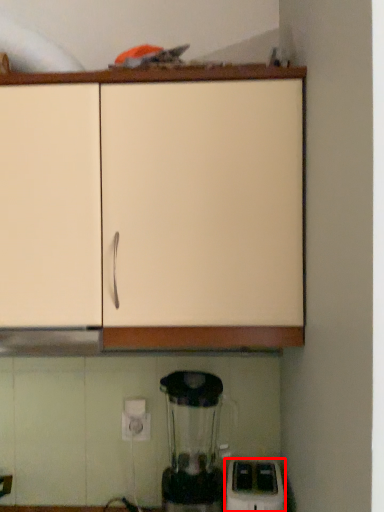
Question: Where is home appliance (annotated by the red box) located in relation to cabinetry in the image?

Choices:
 (A) left
 (B) right

Answer: (B)